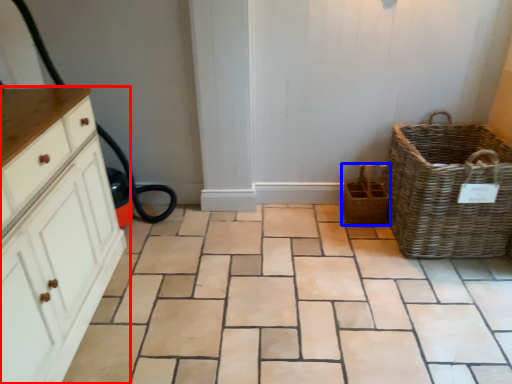
Question: Which point is further to the camera, chest of drawers (highlighted by a red box) or basket (highlighted by a blue box)?

Choices:
 (A) chest of drawers
 (B) basket

Answer: (B)